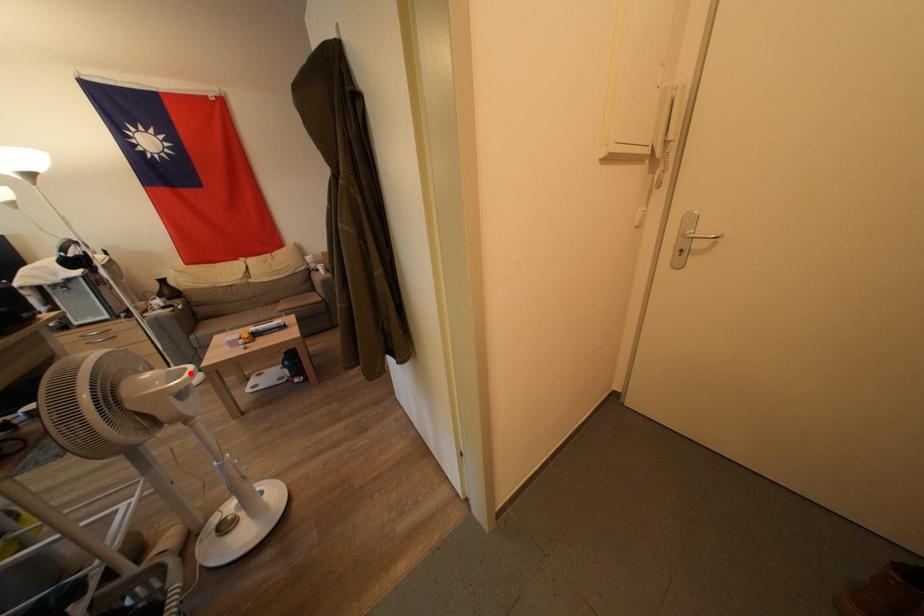
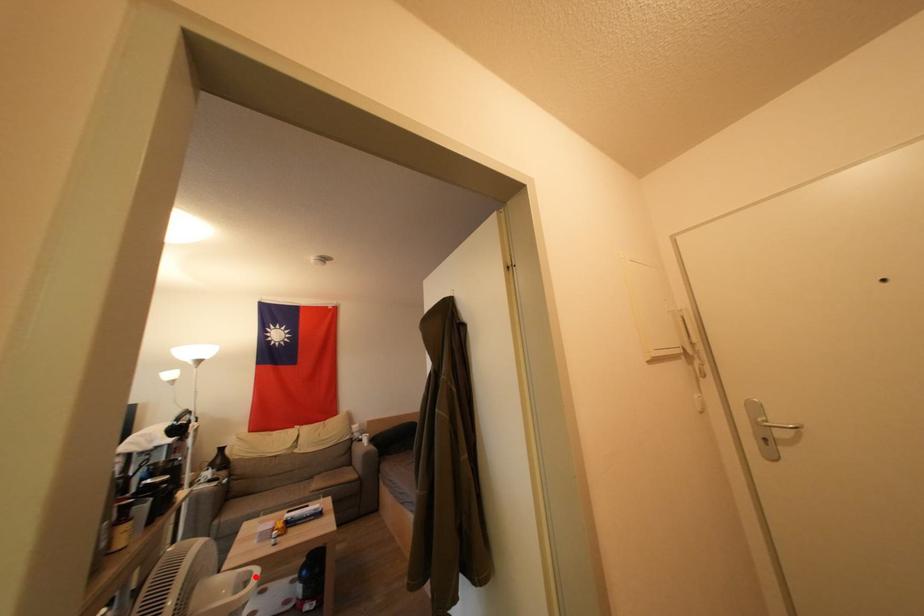
I am providing you with two images of the same scene from different viewpoints. A red point is marked on the first image and another point is marked on the second image. Is the marked point in image1 the same physical position as the marked point in image2?

Yes